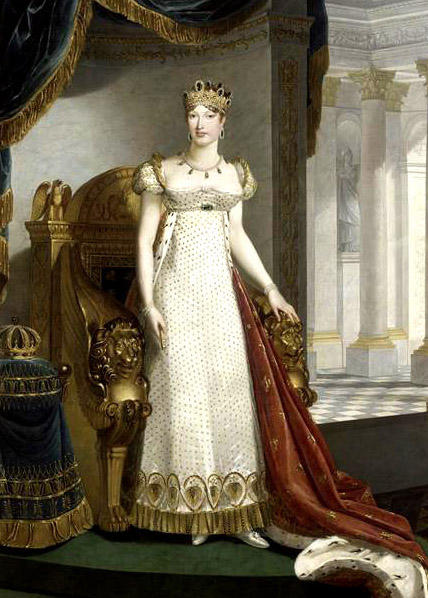
Locate an element on the screen. Image resolution: width=428 pixels, height=598 pixels. checkerboard floor is located at coordinates (359, 410).